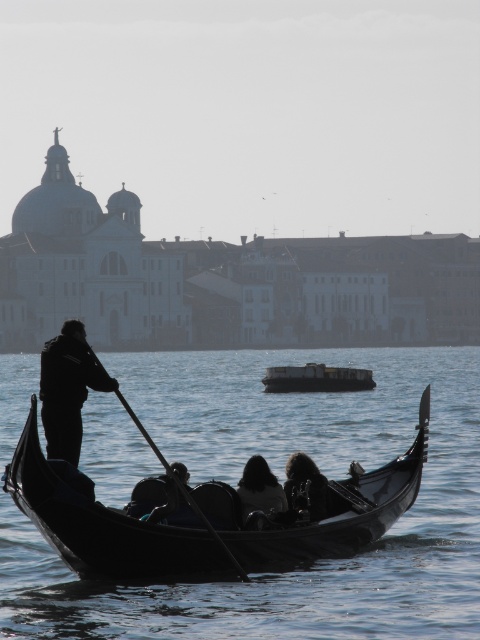
Based on the photo, is metallic gray barge at center behind black wood paddle at center?

That is True.

In the scene shown: Between metallic gray barge at center and black wood paddle at center, which one appears on the left side from the viewer's perspective?

black wood paddle at center is more to the left.

Image resolution: width=480 pixels, height=640 pixels. Identify the location of metallic gray barge at center. (316, 378).

This screenshot has width=480, height=640. Find the location of `metallic gray barge at center`. metallic gray barge at center is located at coordinates (316, 378).

Is dark brown leather jacket at center above black wood paddle at center?

Actually, dark brown leather jacket at center is below black wood paddle at center.

Image resolution: width=480 pixels, height=640 pixels. Describe the element at coordinates (307, 486) in the screenshot. I see `dark brown leather jacket at center` at that location.

Which is in front, point (298, 492) or point (232, 561)?

Positioned in front is point (232, 561).

Where is `dark brown leather jacket at center`? This screenshot has width=480, height=640. dark brown leather jacket at center is located at coordinates (307, 486).

The height and width of the screenshot is (640, 480). I want to click on black polished gondola at center, so pos(101,524).

Is black polished gondola at center below dark hair at center?

Actually, black polished gondola at center is above dark hair at center.

Does point (98, 544) lie behind point (239, 496)?

That is False.

Where is `black polished gondola at center`? The width and height of the screenshot is (480, 640). black polished gondola at center is located at coordinates (101, 524).